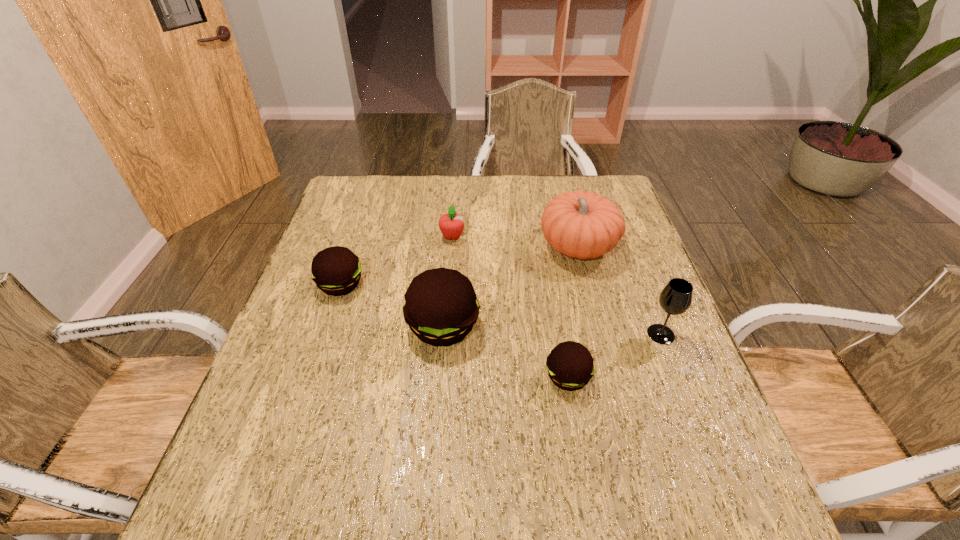
Observe the arrangement of all pattys in the image. To keep them evenly spaced, where would you place another patty on the right? Please locate a free space. Please provide its 2D coordinates. Your answer should be formatted as a tuple, i.e. [(x, y)], where the tuple contains the x and y coordinates of a point satisfying the conditions above.

[(724, 440)]